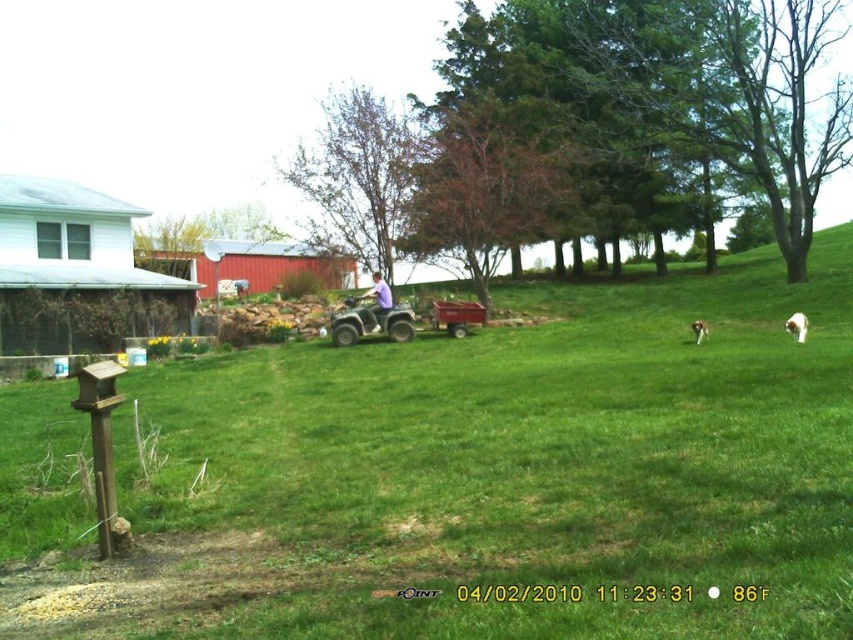
Question: Does green matte/soft tractor at center appear over white fur dog at lower right?

Choices:
 (A) yes
 (B) no

Answer: (A)

Question: Does green matte/soft tractor at center lie behind white fluffy dog at right?

Choices:
 (A) no
 (B) yes

Answer: (B)

Question: Which point is closer to the camera taking this photo?

Choices:
 (A) click(845, 502)
 (B) click(374, 305)

Answer: (A)

Question: Considering the relative positions of green matte/soft tractor at center and white fur dog at lower right in the image provided, where is green matte/soft tractor at center located with respect to white fur dog at lower right?

Choices:
 (A) right
 (B) left

Answer: (B)

Question: Among these objects, which one is nearest to the camera?

Choices:
 (A) green matte/soft tractor at center
 (B) white fur dog at lower right
 (C) white fluffy dog at right
 (D) green grass at center

Answer: (D)

Question: Which object appears farthest from the camera in this image?

Choices:
 (A) white fluffy dog at right
 (B) green matte/soft tractor at center
 (C) green grass at center
 (D) white fur dog at lower right

Answer: (B)